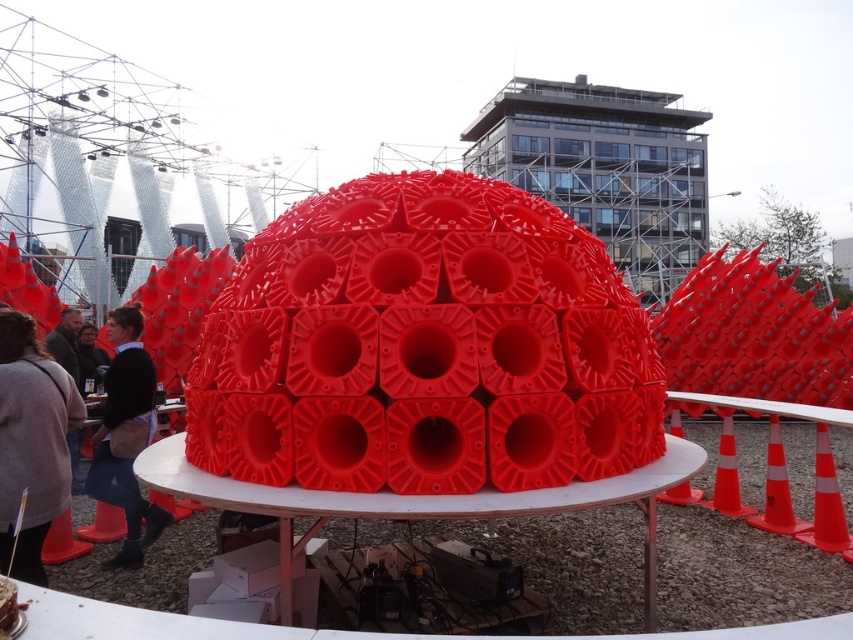
You are a delivery person trying to navigate around the installation. You need to place a box between the orange plastic cone at right and the orange traffic cone at right. Can you fit the box there if it requires a space of 1 meter between the two cones?

The orange plastic cone at right is to the right of orange traffic cone at right, so there is space between them. However, the exact distance isn

You are standing in front of the outdoor installation and want to take a photo that includes both the orange reflective cone at center and the rubber cone at lower left. Which cone should you position to your right side to include both in the frame?

To include both the orange reflective cone at center and the rubber cone at lower left in the frame, position the orange reflective cone at center to your right side since it is already to the right of the rubber cone at lower left.

You are a delivery person who needs to place a large box that is 1.2 meters tall. You see the orange plastic cone at right and the orange traffic cone at right. Which cone can you place the box next to without it being taller than the cone?

Answer: The orange plastic cone at right is much taller than the orange traffic cone at right, so you should place the large box next to the orange plastic cone at right since it can accommodate the box height of 1.2 meters.